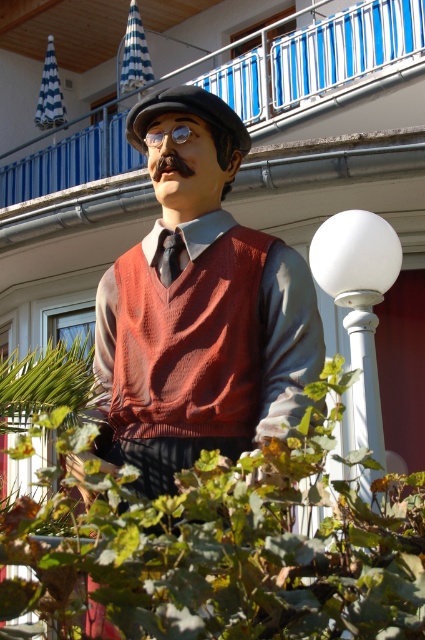
This screenshot has height=640, width=425. What do you see at coordinates (200, 308) in the screenshot? I see `matte brown vest at center` at bounding box center [200, 308].

Does matte brown vest at center appear under black silk tie at center?

Correct, matte brown vest at center is located below black silk tie at center.

Is point (215, 404) behind point (172, 240)?

No, (215, 404) is in front of (172, 240).

The height and width of the screenshot is (640, 425). I want to click on matte brown vest at center, so click(x=200, y=308).